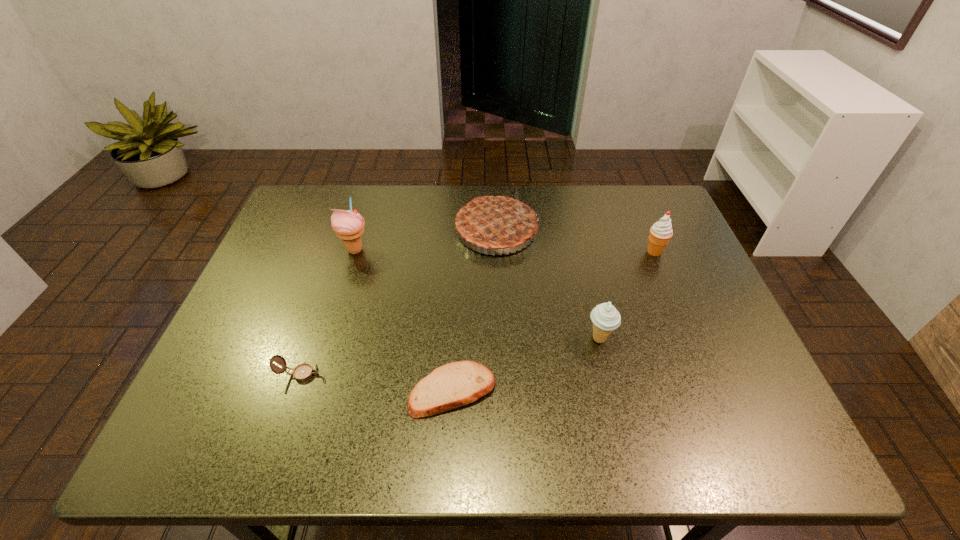
Where is `vacant space located 0.290m on the back of the second icecream from left to right`? The height and width of the screenshot is (540, 960). vacant space located 0.290m on the back of the second icecream from left to right is located at coordinates (578, 247).

Identify the location of vacant space located 0.120m on the face of the compass. This screenshot has height=540, width=960. (378, 374).

You are a GUI agent. You are given a task and a screenshot of the screen. Output one action in this format:
    pyautogui.click(x=<x>, y=<y>)
    Task: Click on the free space located 0.110m on the left of the pita bread
    This screenshot has width=960, height=540.
    Given the screenshot: What is the action you would take?
    pyautogui.click(x=357, y=390)

You are a GUI agent. You are given a task and a screenshot of the screen. Output one action in this format:
    pyautogui.click(x=<x>, y=<y>)
    Task: Click on the object located in the far edge section of the desktop
    This screenshot has height=540, width=960.
    Given the screenshot: What is the action you would take?
    pyautogui.click(x=494, y=222)

Locate an element on the screen. The image size is (960, 540). object located at the near edge is located at coordinates (453, 385).

Find the location of a particular element. This screenshot has height=540, width=960. object positioned at the left edge is located at coordinates (302, 372).

The height and width of the screenshot is (540, 960). I want to click on object that is positioned at the right edge, so click(x=660, y=233).

What are the coordinates of `free space at the far edge` in the screenshot? It's located at (374, 211).

In the image, there is a desktop. Where is `free space at the near edge`? free space at the near edge is located at coordinates (641, 450).

Find the location of a particular element. The height and width of the screenshot is (540, 960). free region at the left edge of the desktop is located at coordinates coord(279,355).